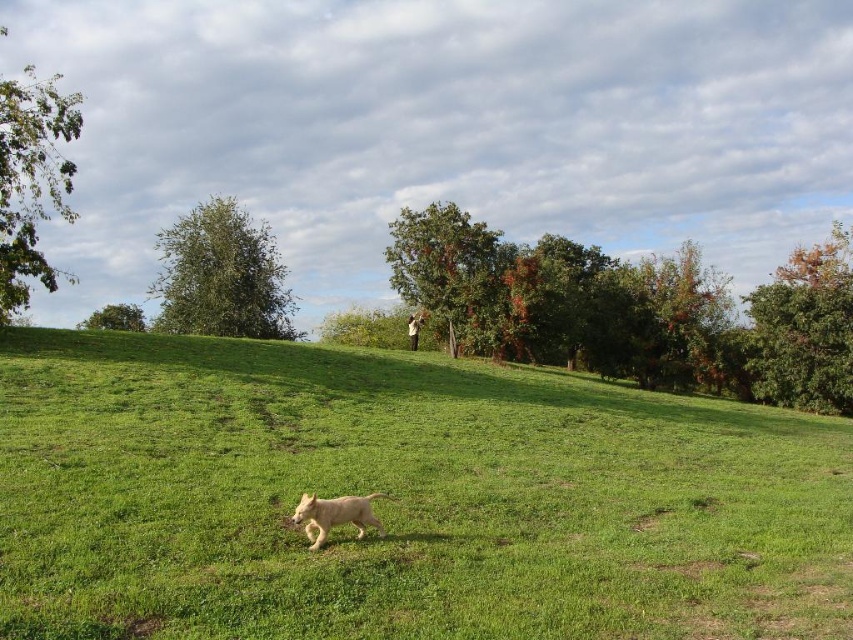
Question: Can you confirm if green grassy field at center is bigger than white fur dog at center?

Choices:
 (A) yes
 (B) no

Answer: (A)

Question: Does green grassy field at center appear on the left side of white fur dog at center?

Choices:
 (A) yes
 (B) no

Answer: (A)

Question: Is green grassy field at center to the right of white fur dog at center from the viewer's perspective?

Choices:
 (A) yes
 (B) no

Answer: (B)

Question: Among these objects, which one is nearest to the camera?

Choices:
 (A) green grassy field at center
 (B) white fur dog at center

Answer: (A)